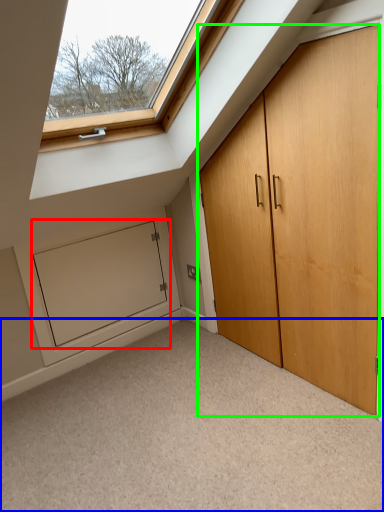
Question: Based on their relative distances, which object is farther from screen door (highlighted by a red box)? Choose from corridor (highlighted by a blue box) and door (highlighted by a green box).

Choices:
 (A) corridor
 (B) door

Answer: (B)